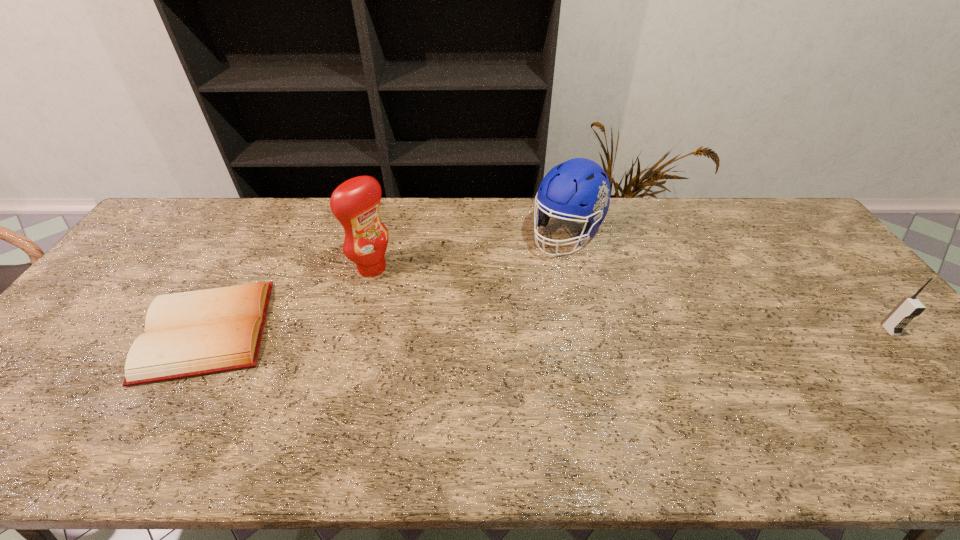
In the image, there is a desktop. Identify the location of free space at the left edge. This screenshot has height=540, width=960. (147, 268).

In order to click on vacant space at the right edge of the desktop in this screenshot , I will do `click(807, 283)`.

The height and width of the screenshot is (540, 960). I want to click on free space at the far left corner, so click(156, 231).

In the image, there is a desktop. Where is `vacant space at the far right corner`? The height and width of the screenshot is (540, 960). vacant space at the far right corner is located at coordinates (818, 240).

At what (x,y) coordinates should I click in order to perform the action: click on free space at the near right corner of the desktop. Please return your answer as a coordinate pair (x, y). The image size is (960, 540). Looking at the image, I should click on (939, 400).

At what (x,y) coordinates should I click in order to perform the action: click on vacant space that is in between the leftmost object and the cellular telephone. Please return your answer as a coordinate pair (x, y). This screenshot has height=540, width=960. Looking at the image, I should click on (548, 330).

Where is `free space between the rightmost object and the second object from right to left`? free space between the rightmost object and the second object from right to left is located at coordinates (728, 282).

Image resolution: width=960 pixels, height=540 pixels. What are the coordinates of `free space between the third tallest object and the leftmost object` in the screenshot? It's located at (548, 330).

I want to click on free space between the Bible and the third object from left to right, so click(387, 282).

You are a GUI agent. You are given a task and a screenshot of the screen. Output one action in this format:
    pyautogui.click(x=<x>, y=<y>)
    Task: Click on the empty space that is in between the football helmet and the cellular telephone
    Image resolution: width=960 pixels, height=540 pixels.
    Given the screenshot: What is the action you would take?
    pyautogui.click(x=728, y=282)